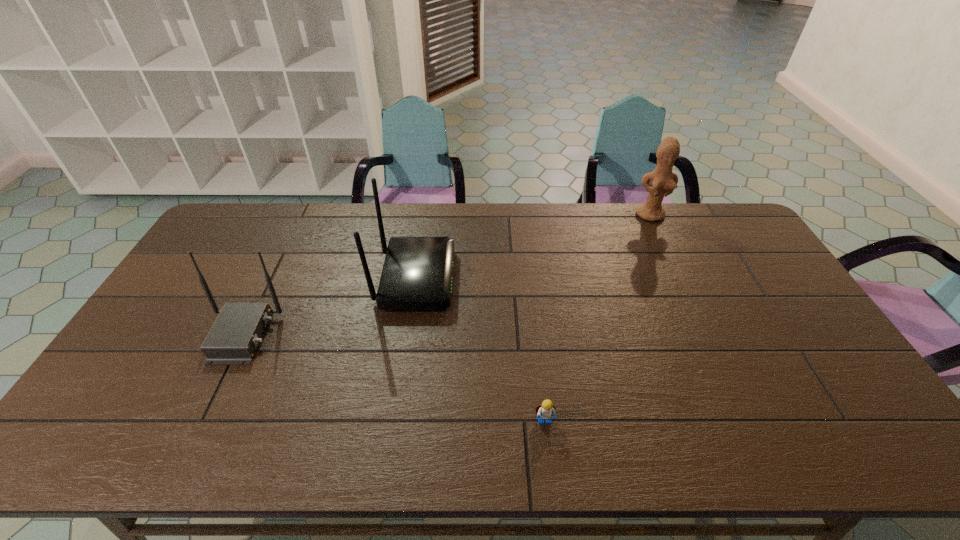
Where is `the farthest object`? the farthest object is located at coordinates (663, 181).

I want to click on figurine, so click(663, 181).

This screenshot has width=960, height=540. Identify the location of the taller router. (417, 274).

Where is `the third object from right to left`? This screenshot has width=960, height=540. the third object from right to left is located at coordinates (417, 274).

The height and width of the screenshot is (540, 960). I want to click on the left router, so click(234, 337).

Identify the location of the shorter router. The height and width of the screenshot is (540, 960). (234, 337).

You are a GUI agent. You are given a task and a screenshot of the screen. Output one action in this format:
    pyautogui.click(x=<x>, y=<y>)
    Task: Click on the shortest object
    The height and width of the screenshot is (540, 960).
    Given the screenshot: What is the action you would take?
    pyautogui.click(x=545, y=410)

Where is `the nearest object`? the nearest object is located at coordinates (545, 410).

The height and width of the screenshot is (540, 960). In order to click on vacant region located on the front-facing side of the figurine in this screenshot , I will do `click(660, 237)`.

Locate an element on the screen. This screenshot has height=540, width=960. free space located on the front-facing side of the right router is located at coordinates (478, 279).